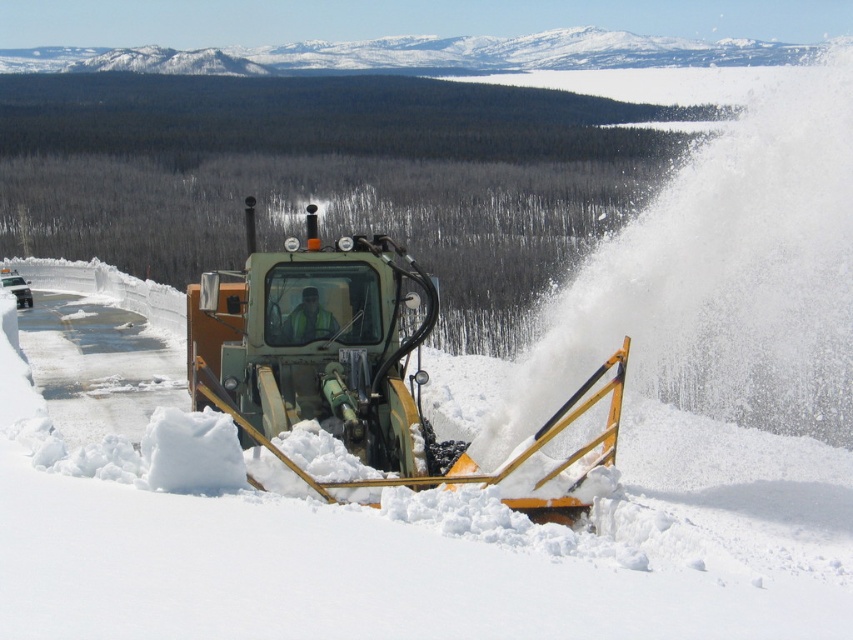
You are a drone operator trying to capture the snowplow in the center of the image. According to the coordinates provided, where should you position your drone to ensure it is directly above the green metallic snowplow at center?

The green metallic snowplow at center is located at coordinates point [346,362], so positioning the drone directly above this point will ensure it captures the snowplow.

You are a city planner assessing road clearance efficiency. You observe the yellow metallic snowplow at center and the green metallic snowplow at center in the image. Which snowplow has a wider blade for clearing more snow at once?

The yellow metallic snowplow at center has a wider blade than the green metallic snowplow at center, allowing it to clear more snow at once.